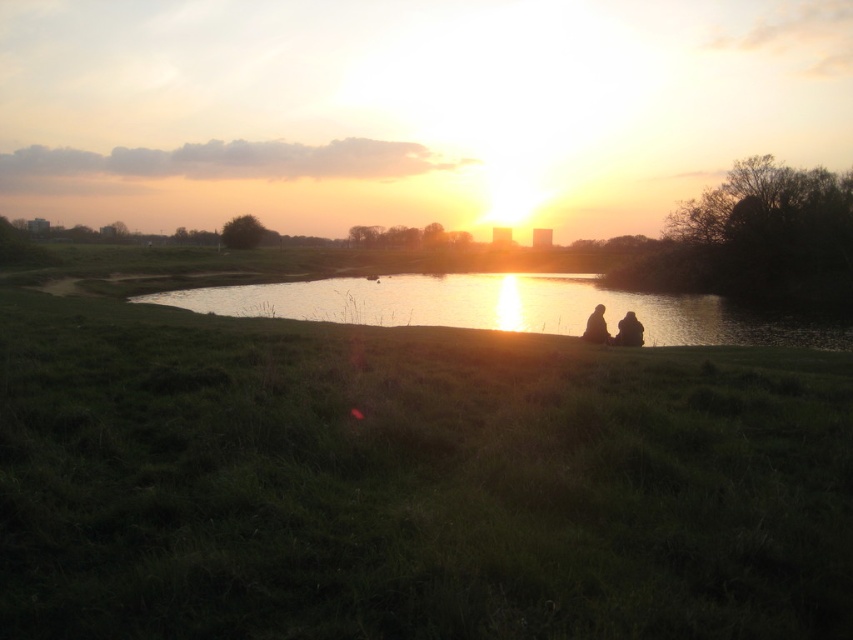
Can you confirm if silhouette fabric couple at center is positioned to the left of matte black person at lower right?

Correct, you'll find silhouette fabric couple at center to the left of matte black person at lower right.

The height and width of the screenshot is (640, 853). I want to click on silhouette fabric couple at center, so click(x=618, y=326).

Describe the element at coordinates (410, 483) in the screenshot. This screenshot has width=853, height=640. I see `green grassy at center` at that location.

Is point (770, 557) behind point (721, 330)?

No, (770, 557) is in front of (721, 330).

At what (x,y) coordinates should I click in order to perform the action: click on green grassy at center. Please return your answer as a coordinate pair (x, y). Image resolution: width=853 pixels, height=640 pixels. Looking at the image, I should click on (410, 483).

Between green grassy at center and silhouette figure at center, which one appears on the right side from the viewer's perspective?

From the viewer's perspective, silhouette figure at center appears more on the right side.

Is the position of green grassy at center more distant than that of silhouette figure at center?

No, green grassy at center is in front of silhouette figure at center.

What do you see at coordinates (410, 483) in the screenshot? I see `green grassy at center` at bounding box center [410, 483].

This screenshot has width=853, height=640. Identify the location of green grassy at center. (410, 483).